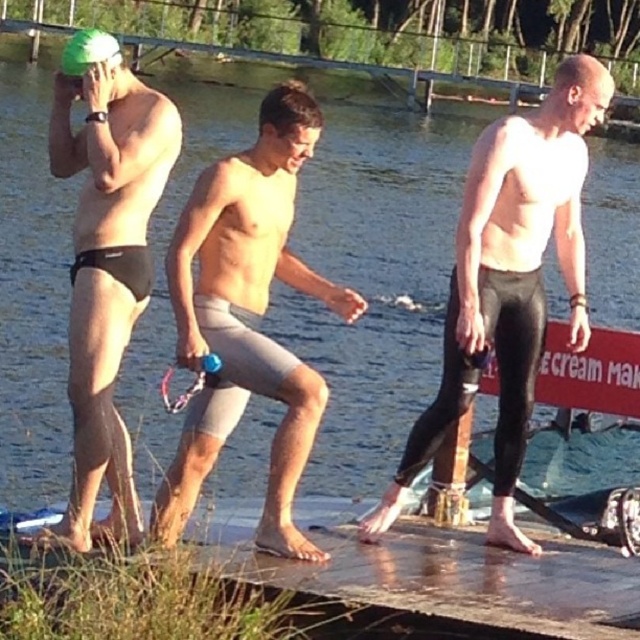
Which is in front, point (227, 380) or point (76, 68)?

Positioned in front is point (227, 380).

Is point (294, 422) positioned behind point (65, 51)?

No, it is in front of (65, 51).

Find the location of a particular element. The height and width of the screenshot is (640, 640). gray matte shorts at center is located at coordinates (246, 317).

Does black matte wetsuit at center have a greater height compared to green matte swim cap at upper left?

No, black matte wetsuit at center is not taller than green matte swim cap at upper left.

Does point (454, 337) come closer to viewer compared to point (97, 60)?

No, (454, 337) is further to viewer.

Locate an element on the screen. This screenshot has height=640, width=640. black matte wetsuit at center is located at coordinates (513, 358).

Who is more distant from viewer, (x=157, y=129) or (x=524, y=282)?

Positioned behind is point (x=524, y=282).

Does black matte swim cap at upper left come behind black matte wetsuit at center?

No, it is not.

This screenshot has height=640, width=640. What do you see at coordinates (106, 275) in the screenshot?
I see `black matte swim cap at upper left` at bounding box center [106, 275].

Where is `black matte swim cap at upper left`? black matte swim cap at upper left is located at coordinates (106, 275).